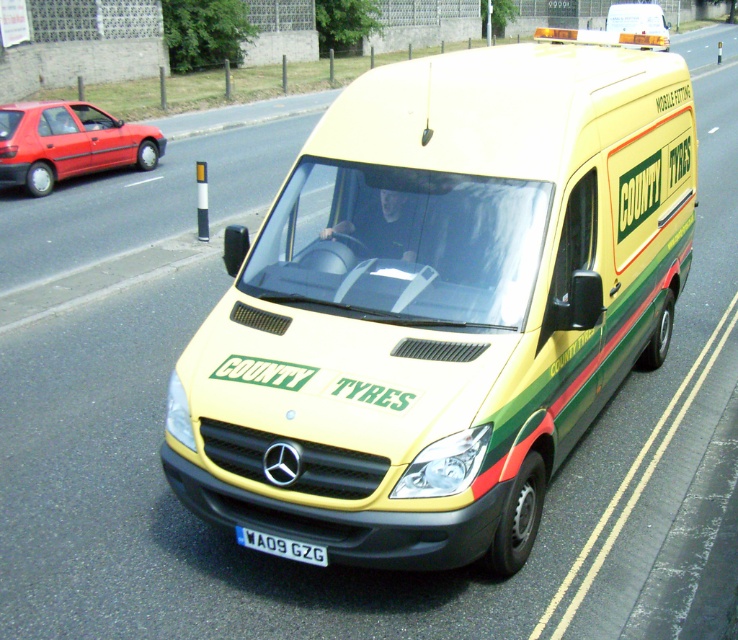
Is yellow matte van at upper center above white plastic license plate at center?

Yes.

Which of these two, yellow matte van at upper center or white plastic license plate at center, stands shorter?

white plastic license plate at center is shorter.

Identify the location of yellow matte van at upper center. The width and height of the screenshot is (738, 640). (637, 20).

Does yellow matte van at center have a larger size compared to white plastic license plate at center?

Indeed, yellow matte van at center has a larger size compared to white plastic license plate at center.

Is point (418, 262) positioned before point (269, 552)?

No, it is not.

Who is more forward, (480, 234) or (272, 545)?

Point (272, 545) is more forward.

Where is `yellow matte van at center`? yellow matte van at center is located at coordinates (441, 305).

Does point (666, 84) come closer to viewer compared to point (607, 28)?

Yes, it is in front of point (607, 28).

Is yellow matte van at center shorter than yellow matte van at upper center?

Correct, yellow matte van at center is not as tall as yellow matte van at upper center.

Does point (231, 264) lie behind point (649, 16)?

No, it is not.

Identify the location of yellow matte van at center. Image resolution: width=738 pixels, height=640 pixels. (441, 305).